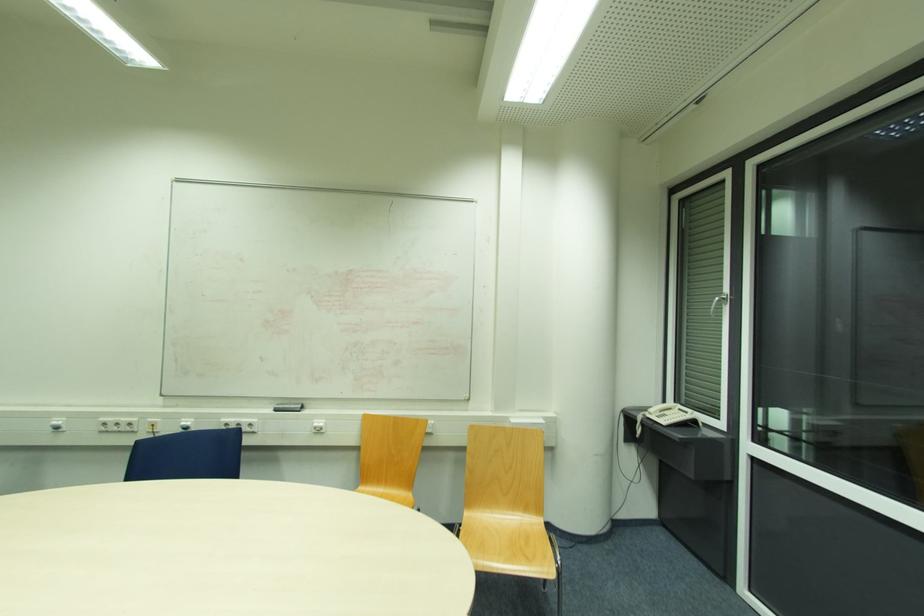
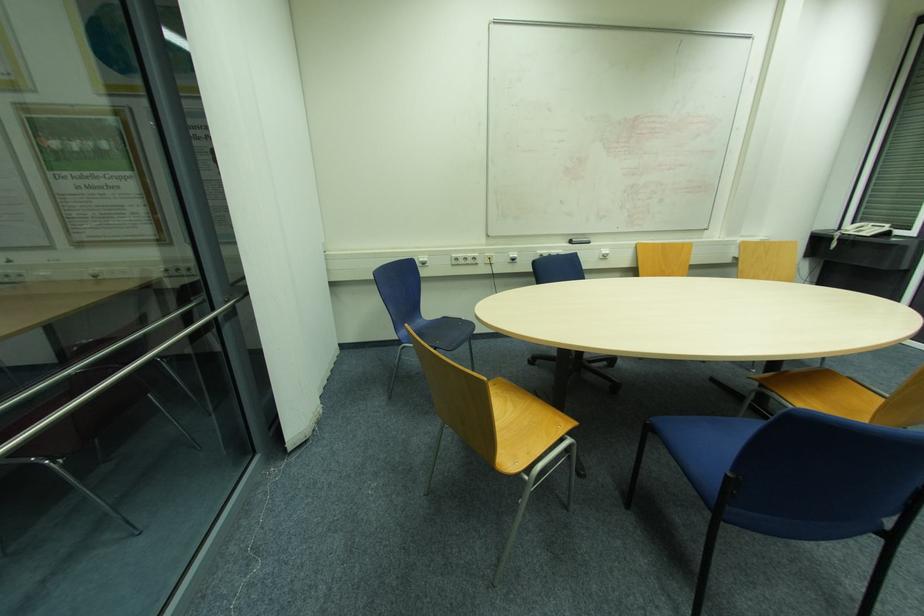
Locate, in the second image, the point that corresponds to pixel 117 424 in the first image.

(467, 259)